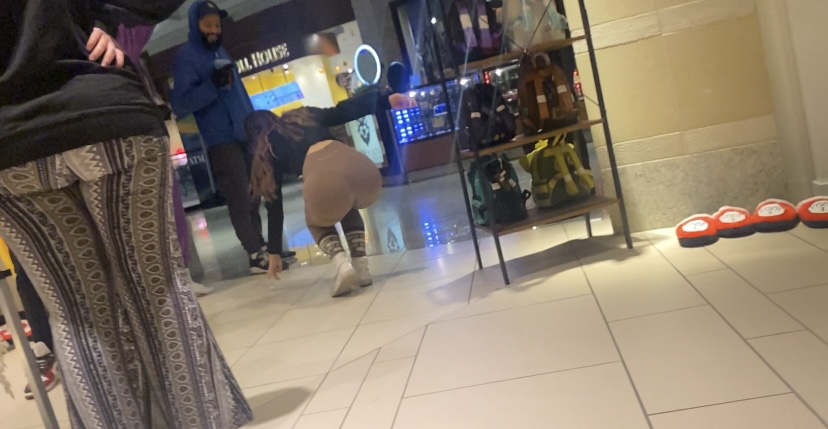
You are a GUI agent. You are given a task and a screenshot of the screen. Output one action in this format:
    pyautogui.click(x=<x>, y=<y>)
    Task: Click on the light gray tiled flooring
    The height and width of the screenshot is (429, 828).
    Given the screenshot: What is the action you would take?
    pyautogui.click(x=511, y=354)